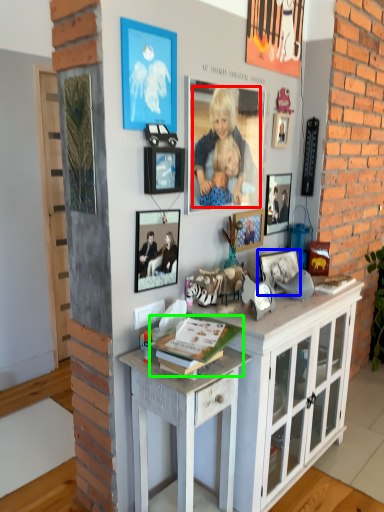
Question: Considering the real-world distances, which object is farthest from person (highlighted by a red box)? picture frame (highlighted by a blue box) or magazine (highlighted by a green box)?

Choices:
 (A) picture frame
 (B) magazine

Answer: (B)